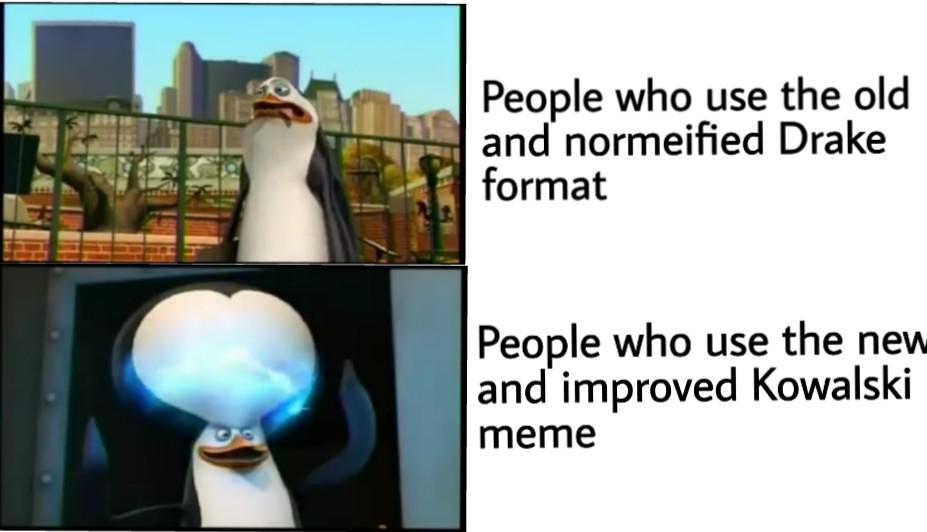
Where is `wall`? The image size is (927, 532). wall is located at coordinates point(384,228).